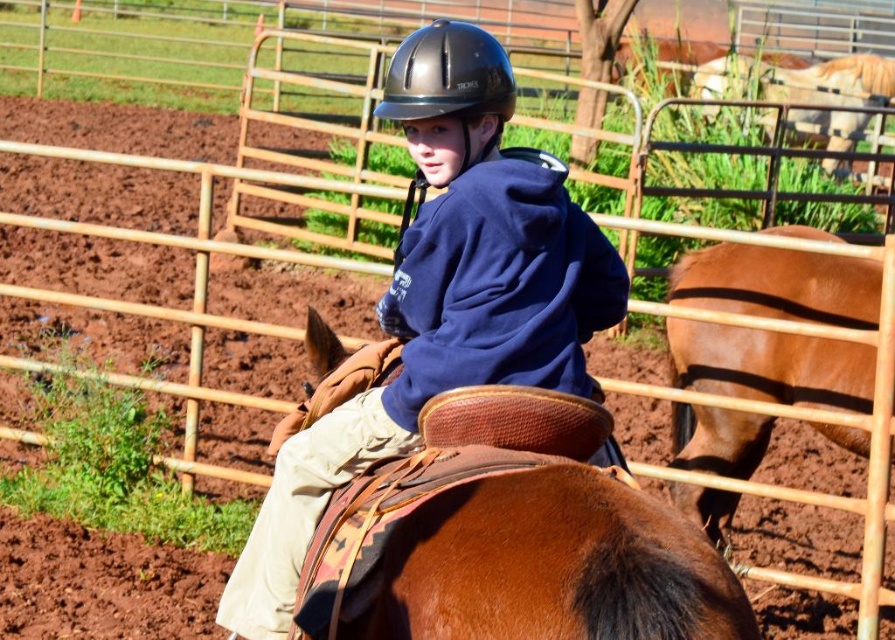
Who is positioned more to the right, brown leather saddle at center or glossy black helmet at center?

brown leather saddle at center

Where is `brown leather saddle at center`? The width and height of the screenshot is (895, 640). brown leather saddle at center is located at coordinates (516, 552).

Between point (618, 637) and point (723, 432), which one is positioned behind?

The point (723, 432) is behind.

The height and width of the screenshot is (640, 895). What do you see at coordinates (516, 552) in the screenshot? I see `brown leather saddle at center` at bounding box center [516, 552].

Find the location of `brown leather saddle at center`. brown leather saddle at center is located at coordinates (516, 552).

Which of these two, matte black helmet at center or glossy black helmet at center, stands taller?

matte black helmet at center

Does point (430, 58) lie behind point (446, 56)?

No, (430, 58) is closer to viewer.

This screenshot has height=640, width=895. In order to click on matte black helmet at center in this screenshot , I will do `click(439, 301)`.